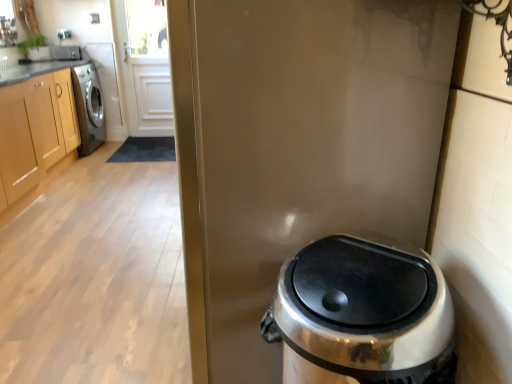
Question: Is glossy metallic screen door at center thinner than satin silver trash can at lower right?

Choices:
 (A) no
 (B) yes

Answer: (A)

Question: Considering the relative sizes of glossy metallic screen door at center and satin silver trash can at lower right in the image provided, is glossy metallic screen door at center shorter than satin silver trash can at lower right?

Choices:
 (A) yes
 (B) no

Answer: (B)

Question: Considering the relative sizes of glossy metallic screen door at center and satin silver trash can at lower right in the image provided, is glossy metallic screen door at center bigger than satin silver trash can at lower right?

Choices:
 (A) no
 (B) yes

Answer: (B)

Question: Considering the relative sizes of glossy metallic screen door at center and satin silver trash can at lower right in the image provided, is glossy metallic screen door at center taller than satin silver trash can at lower right?

Choices:
 (A) no
 (B) yes

Answer: (B)

Question: From the image's perspective, would you say glossy metallic screen door at center is positioned over satin silver trash can at lower right?

Choices:
 (A) no
 (B) yes

Answer: (B)

Question: Does glossy metallic screen door at center lie in front of satin silver trash can at lower right?

Choices:
 (A) yes
 (B) no

Answer: (B)

Question: Is light brown wood cabinets at left at the left side of satin silver trash can at lower right?

Choices:
 (A) yes
 (B) no

Answer: (A)

Question: From the image's perspective, does light brown wood cabinets at left appear higher than satin silver trash can at lower right?

Choices:
 (A) no
 (B) yes

Answer: (B)

Question: From a real-world perspective, is light brown wood cabinets at left located beneath satin silver trash can at lower right?

Choices:
 (A) yes
 (B) no

Answer: (B)

Question: Does light brown wood cabinets at left have a lesser width compared to satin silver trash can at lower right?

Choices:
 (A) no
 (B) yes

Answer: (A)

Question: Is light brown wood cabinets at left touching satin silver trash can at lower right?

Choices:
 (A) no
 (B) yes

Answer: (A)

Question: Can you confirm if light brown wood cabinets at left is positioned to the right of satin silver trash can at lower right?

Choices:
 (A) yes
 (B) no

Answer: (B)

Question: Considering the relative positions of satin silver trash can at lower right and glossy metallic screen door at center in the image provided, is satin silver trash can at lower right behind glossy metallic screen door at center?

Choices:
 (A) no
 (B) yes

Answer: (A)